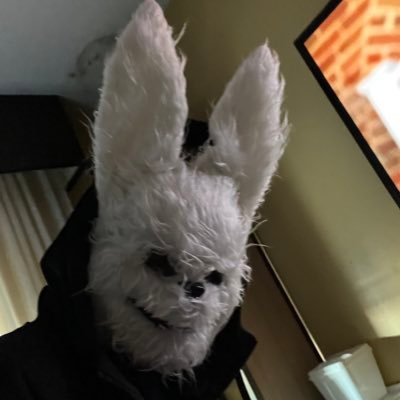
You are a GUI agent. You are given a task and a screenshot of the screen. Output one action in this format:
    pyautogui.click(x=<x>, y=<y>)
    Task: Click on the coat
    
    Given the screenshot: What is the action you would take?
    pyautogui.click(x=67, y=375)